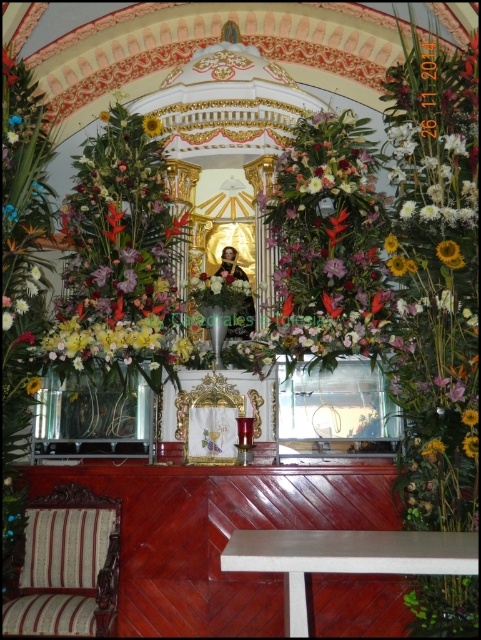
Who is lower down, floral bouquet at center or yellow matte sunflower at upper center?

yellow matte sunflower at upper center is lower down.

Is floral bouquet at center positioned in front of yellow matte sunflower at upper center?

No.

Does point (142, 372) come closer to viewer compared to point (448, 253)?

No, it is behind (448, 253).

You are a GUI agent. You are given a task and a screenshot of the screen. Output one action in this format:
    pyautogui.click(x=<x>, y=<y>)
    Task: Click on the floral bouquet at center
    
    Given the screenshot: What is the action you would take?
    pyautogui.click(x=117, y=253)

Is yellow matte sunflower at upper center closer to the viewer compared to yellow matte sunflower at center?

Yes, it is in front of yellow matte sunflower at center.

Which of these two, yellow matte sunflower at upper center or yellow matte sunflower at center, stands taller?

yellow matte sunflower at upper center

Is point (438, 244) in front of point (155, 125)?

Yes, it is in front of point (155, 125).

This screenshot has width=481, height=640. I want to click on yellow matte sunflower at upper center, so click(447, 250).

Does floral bouquet at center appear on the left side of yellow matte sunflower at center?

Yes, floral bouquet at center is to the left of yellow matte sunflower at center.

Does floral bouquet at center appear over yellow matte sunflower at center?

No, floral bouquet at center is not above yellow matte sunflower at center.

The image size is (481, 640). What do you see at coordinates (117, 253) in the screenshot?
I see `floral bouquet at center` at bounding box center [117, 253].

In order to click on floral bouquet at center in this screenshot , I will do `click(117, 253)`.